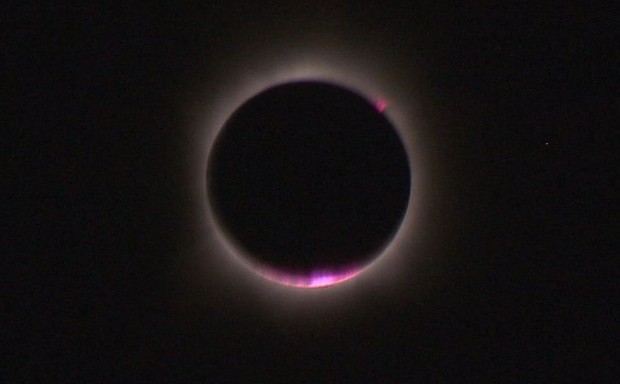
At what (x,y) coordinates should I click in order to perform the action: click on pink light. Please return your answer as a coordinate pair (x, y). Looking at the image, I should click on (379, 104).